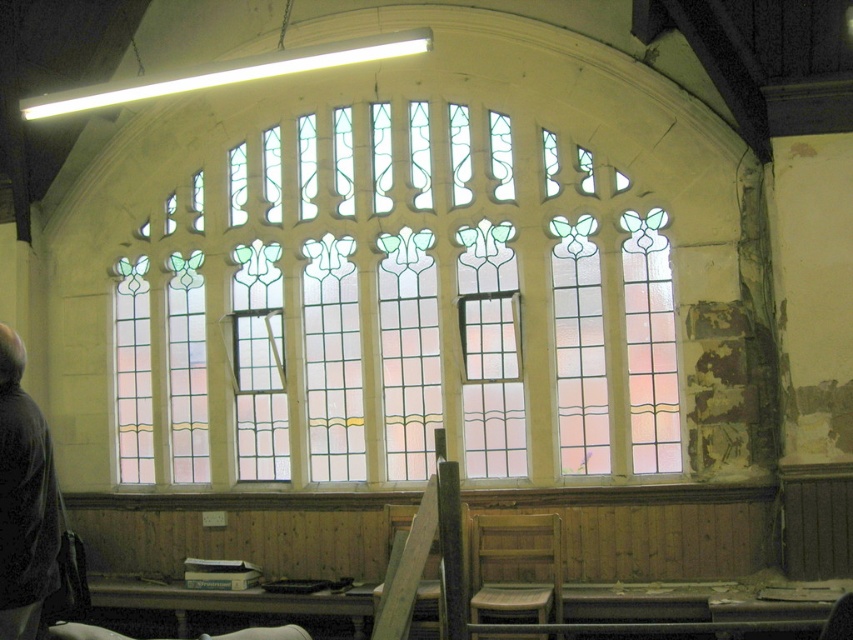
Question: Which point is closer to the camera?

Choices:
 (A) pink stained glass window at center
 (B) dark gray sweater at lower left

Answer: (B)

Question: Is dark gray sweater at lower left thinner than pink stained glass window at center?

Choices:
 (A) yes
 (B) no

Answer: (A)

Question: Which object appears closest to the camera in this image?

Choices:
 (A) dark gray sweater at lower left
 (B) pink stained glass window at center

Answer: (A)

Question: Is dark gray sweater at lower left wider than pink stained glass window at center?

Choices:
 (A) no
 (B) yes

Answer: (A)

Question: Does clear stained glass at center appear on the right side of dark gray sweater at lower left?

Choices:
 (A) yes
 (B) no

Answer: (A)

Question: Which of these objects is positioned farthest from the dark gray sweater at lower left?

Choices:
 (A) clear stained glass at center
 (B) pink stained glass window at center

Answer: (B)